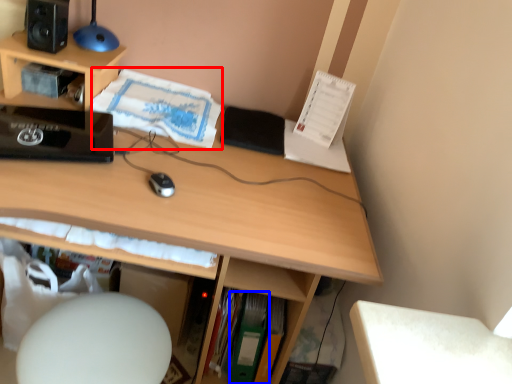
Question: Which point is further to the camera, book (highlighted by a red box) or paperback book (highlighted by a blue box)?

Choices:
 (A) book
 (B) paperback book

Answer: (B)